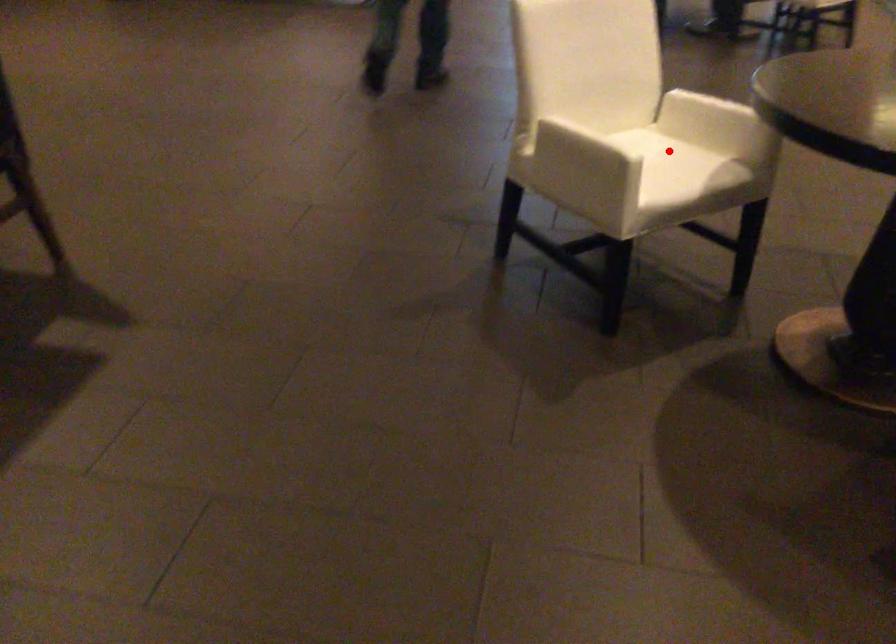
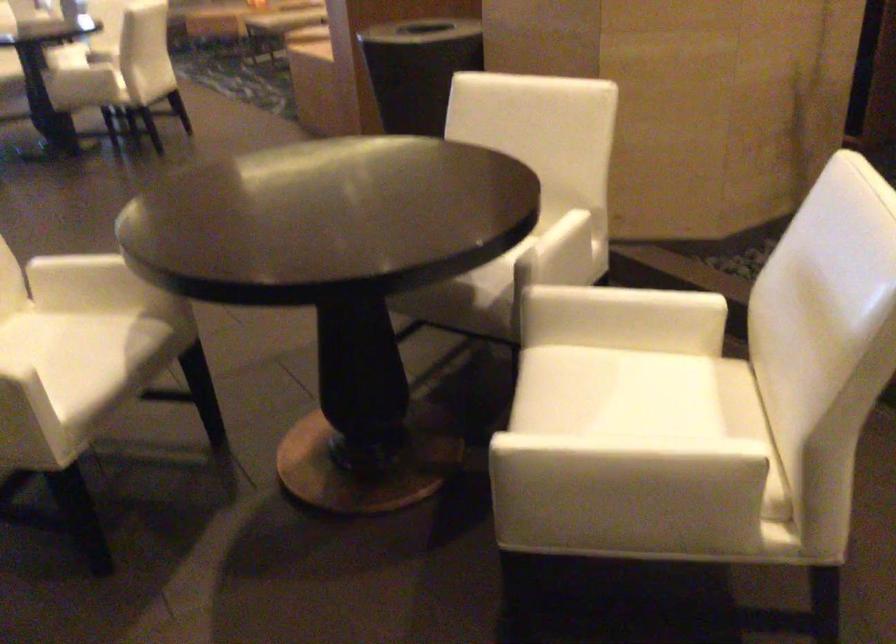
Find the pixel in the second image that matches the highlighted location in the first image.

(67, 336)